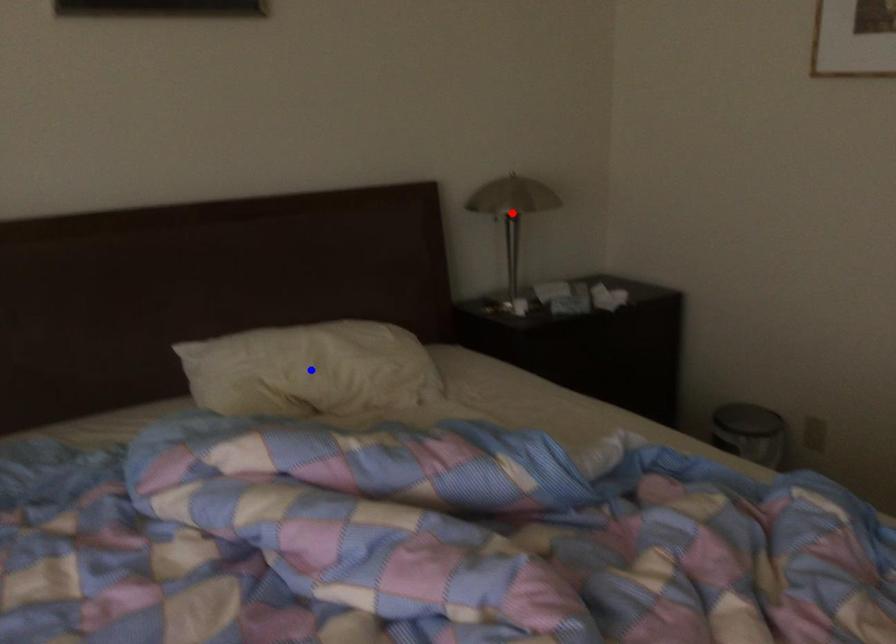
Question: Two points are marked on the image. Which point is closer to the camera?

Choices:
 (A) Blue point is closer.
 (B) Red point is closer.

Answer: (A)